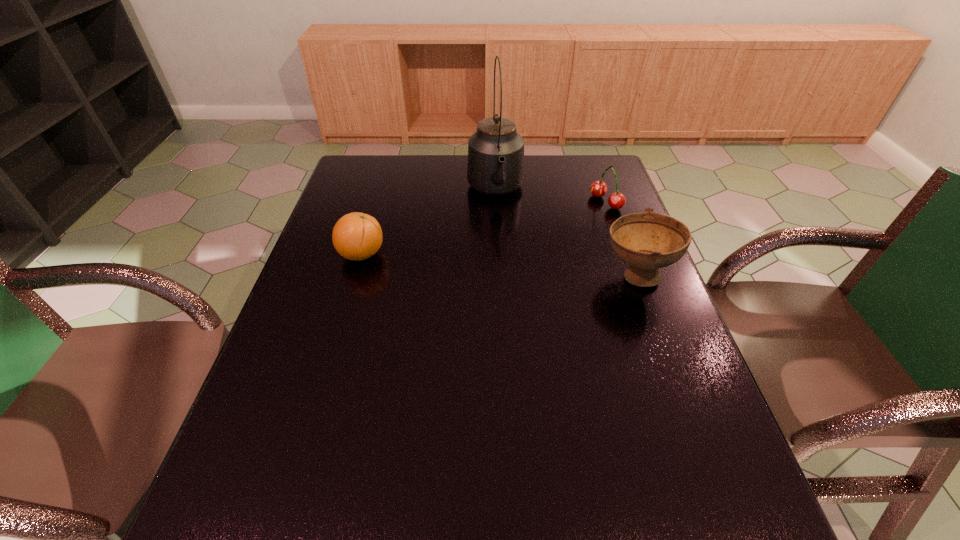
Find the location of a particular element. free space between the leftmost object and the soup bowl is located at coordinates (499, 265).

Point out which object is positioned as the third nearest to the cherry. Please provide its 2D coordinates. Your answer should be formatted as a tuple, i.e. [(x, y)], where the tuple contains the x and y coordinates of a point satisfying the conditions above.

[(356, 236)]

Locate an element on the screen. This screenshot has width=960, height=540. the second closest object to the cherry is located at coordinates pyautogui.click(x=495, y=166).

Identify the location of vacant region that satisfies the following two spatial constraints: 1. on the front side of the cherry; 2. on the left side of the second tallest object. (632, 276).